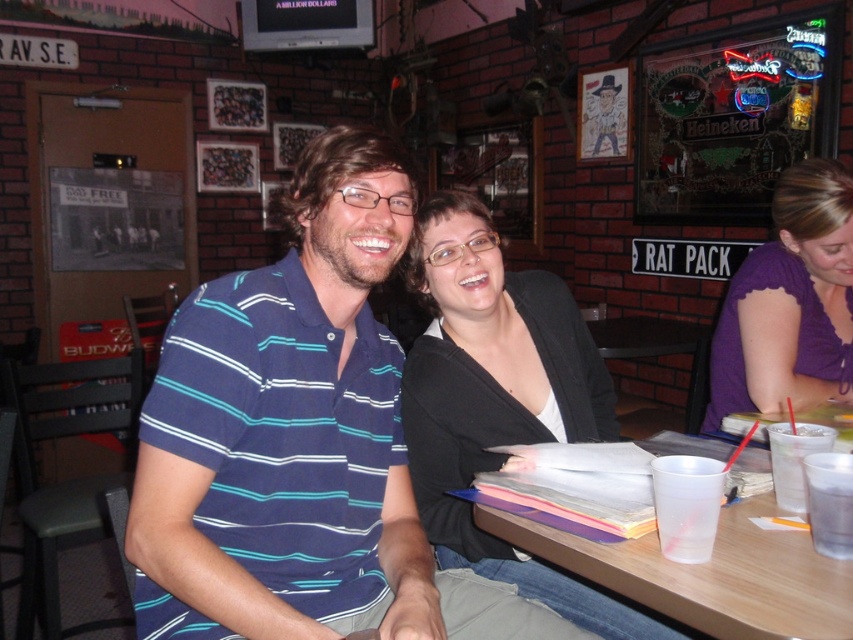
Question: Does blue striped polo shirt at center have a larger size compared to blue striped polo shirt at left?

Choices:
 (A) yes
 (B) no

Answer: (A)

Question: Is black matte cardigan at center thinner than clear plastic cup at table right?

Choices:
 (A) no
 (B) yes

Answer: (A)

Question: Estimate the real-world distances between objects in this image. Which object is closer to the clear plastic cup at lower right?

Choices:
 (A) clear plastic cup at table right
 (B) blue striped polo shirt at center

Answer: (A)

Question: Considering the real-world distances, which object is farthest from the purple satin blouse at upper right?

Choices:
 (A) clear plastic cup at table right
 (B) translucent plastic cup at table right
 (C) blue striped polo shirt at center

Answer: (C)

Question: Does blue striped polo shirt at left have a lesser width compared to clear plastic cup at table right?

Choices:
 (A) yes
 (B) no

Answer: (B)

Question: Which object is positioned closest to the clear plastic cup at lower right?

Choices:
 (A) blue striped polo shirt at left
 (B) black matte cardigan at center
 (C) translucent plastic cup at table right
 (D) purple satin blouse at upper right

Answer: (C)